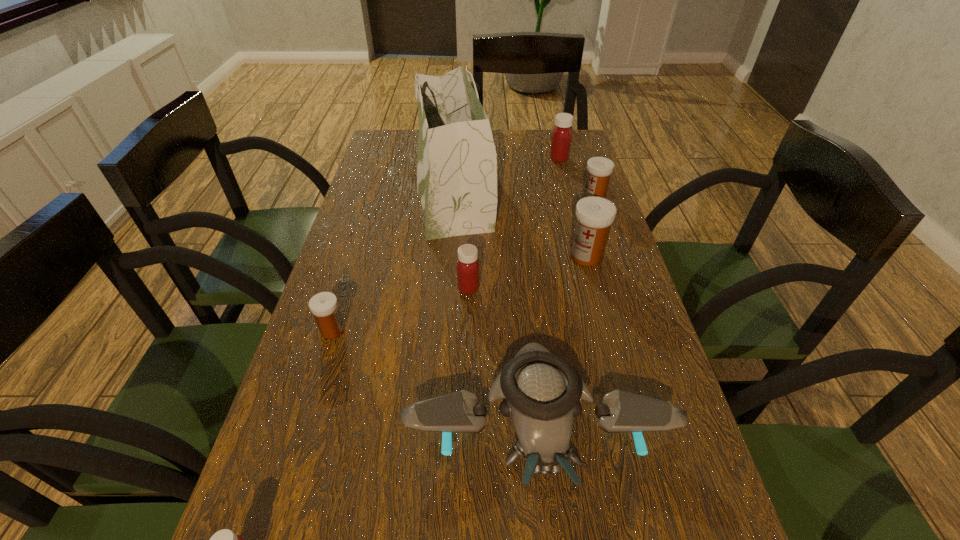
Where is `free space between the tallest object and the biggest red medicine`? free space between the tallest object and the biggest red medicine is located at coordinates (506, 174).

Where is `the fifth closest object to the second farthest white medicine`? Image resolution: width=960 pixels, height=540 pixels. the fifth closest object to the second farthest white medicine is located at coordinates (561, 139).

At what (x,y) coordinates should I click in order to perform the action: click on object that stands as the fifth closest to the seventh farthest object. Please return your answer as a coordinate pair (x, y). The width and height of the screenshot is (960, 540). Looking at the image, I should click on (457, 161).

Identify which medicine is the fourth closest to the biggest white medicine. Please provide its 2D coordinates. Your answer should be formatted as a tuple, i.e. [(x, y)], where the tuple contains the x and y coordinates of a point satisfying the conditions above.

[(324, 306)]

Where is `medicine that can be found as the fifth closest to the fifth nearest object`? This screenshot has width=960, height=540. medicine that can be found as the fifth closest to the fifth nearest object is located at coordinates (225, 539).

Identify which red medicine is the second nearest to the biggest white medicine. Please provide its 2D coordinates. Your answer should be formatted as a tuple, i.e. [(x, y)], where the tuple contains the x and y coordinates of a point satisfying the conditions above.

[(561, 139)]

Select which red medicine appears as the closest to the fifth farthest object. Please provide its 2D coordinates. Your answer should be formatted as a tuple, i.e. [(x, y)], where the tuple contains the x and y coordinates of a point satisfying the conditions above.

[(225, 539)]

Image resolution: width=960 pixels, height=540 pixels. What are the coordinates of `the closest white medicine to the second biggest red medicine` in the screenshot? It's located at (594, 215).

Find the location of a particular element. white medicine that is the third closest to the second farthest red medicine is located at coordinates (599, 169).